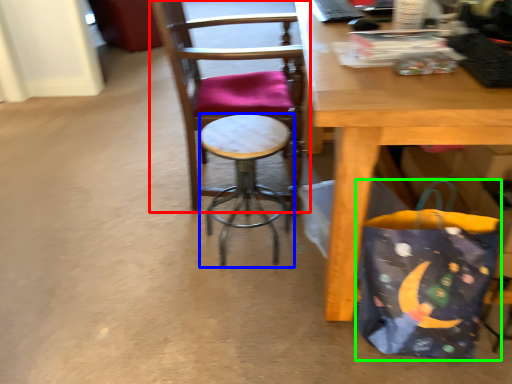
Question: Based on their relative distances, which object is farther from chair (highlighted by a red box)? Choose from stool (highlighted by a blue box) and grocery bag (highlighted by a green box).

Choices:
 (A) stool
 (B) grocery bag

Answer: (B)